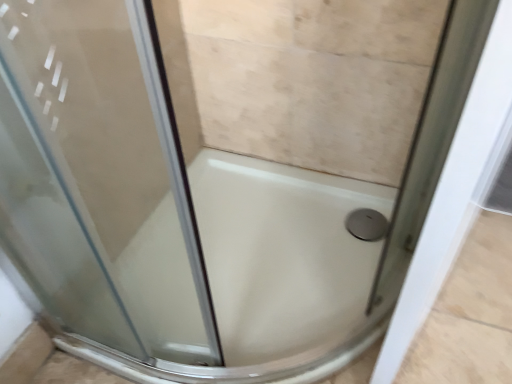
Question: From their relative heights in the image, would you say white glossy bath at center is taller or shorter than satin silver drain at bottom right?

Choices:
 (A) tall
 (B) short

Answer: (A)

Question: From the image's perspective, is white glossy bath at center above or below satin silver drain at bottom right?

Choices:
 (A) above
 (B) below

Answer: (B)

Question: From a real-world perspective, is white glossy bath at center physically located above or below satin silver drain at bottom right?

Choices:
 (A) above
 (B) below

Answer: (A)

Question: Is satin silver drain at bottom right situated inside white glossy bath at center or outside?

Choices:
 (A) outside
 (B) inside

Answer: (B)

Question: From the image's perspective, is satin silver drain at bottom right above or below white glossy bath at center?

Choices:
 (A) above
 (B) below

Answer: (A)

Question: Is satin silver drain at bottom right taller or shorter than white glossy bath at center?

Choices:
 (A) tall
 (B) short

Answer: (B)

Question: Is satin silver drain at bottom right bigger or smaller than white glossy bath at center?

Choices:
 (A) big
 (B) small

Answer: (B)